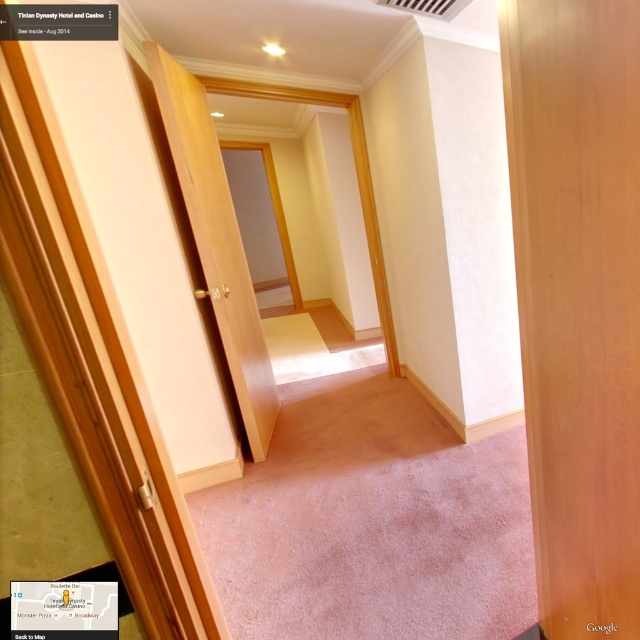
Question: Does light brown wood door at center appear on the left side of wooden door at center?

Choices:
 (A) yes
 (B) no

Answer: (B)

Question: Can you confirm if light brown wood door at center is positioned to the left of wooden door at center?

Choices:
 (A) yes
 (B) no

Answer: (B)

Question: Does light brown wood door at center have a lesser width compared to wooden door at center?

Choices:
 (A) no
 (B) yes

Answer: (B)

Question: Among these objects, which one is nearest to the camera?

Choices:
 (A) wooden door at center
 (B) light brown wood door at center

Answer: (B)

Question: Which point is closer to the camera taking this photo?

Choices:
 (A) (243, 360)
 (B) (531, 304)

Answer: (B)